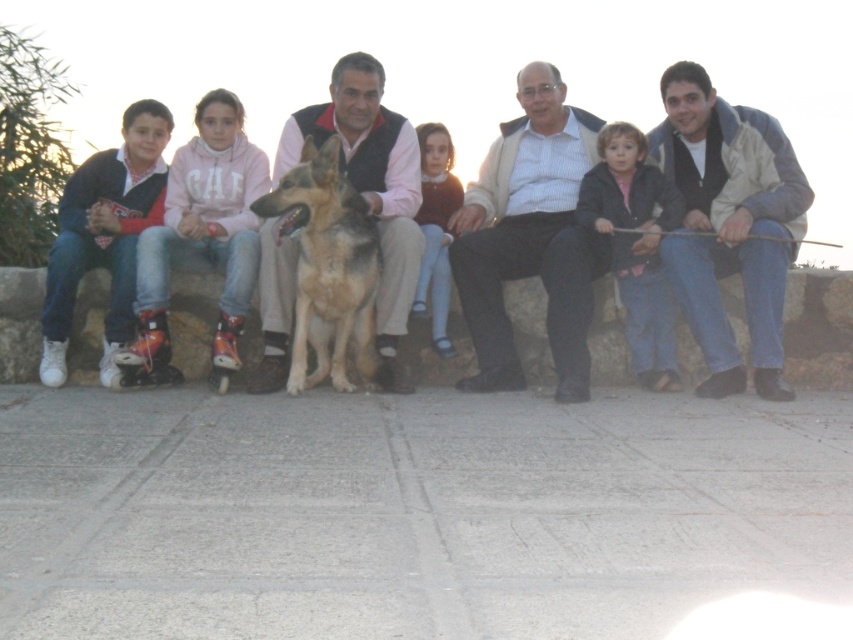
Question: Which point is closer to the camera?

Choices:
 (A) light brown fabric dress at center
 (B) golden fur dog at center
 (C) brown fur dog at center

Answer: (B)

Question: Which point is closer to the camera?

Choices:
 (A) light beige jacket at right
 (B) white striped shirt at center
 (C) light brown fabric dress at center
 (D) matte black jacket at center

Answer: (B)

Question: Which object is the farthest from the golden fur dog at center?

Choices:
 (A) brown fur dog at center
 (B) matte black jacket at center
 (C) light beige jacket at right
 (D) white striped shirt at center

Answer: (C)

Question: Does white striped shirt at center have a larger size compared to light brown fabric dress at center?

Choices:
 (A) yes
 (B) no

Answer: (A)

Question: Does light beige jacket at right lie in front of white striped shirt at center?

Choices:
 (A) no
 (B) yes

Answer: (A)

Question: Can you confirm if light beige jacket at right is positioned to the left of light brown fabric dress at center?

Choices:
 (A) yes
 (B) no

Answer: (B)